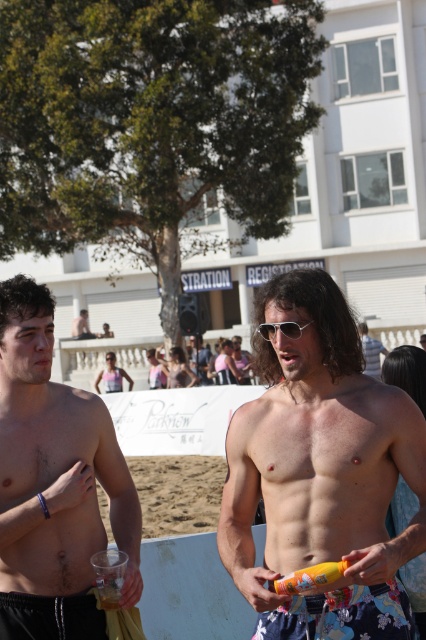
What is the relationship between the size of the black matte shorts at lower left and the shiny silver phone at right?

The black matte shorts at lower left has a smaller size compared to the shiny silver phone at right.

You are a photographer trying to capture a closeup shot of both the smooth tan skin at center and the yellow matte can at center. Given that your camera has a maximum focus range of 16 inches, will you be able to capture both objects in focus at the same time?

The smooth tan skin at center and the yellow matte can at center are 16.63 inches apart from each other, which exceeds the camera maximum focus range of 16 inches. Therefore, you cannot capture both objects in focus at the same time.

You are standing at the beach and want to take a photo of the smooth tan skin at center. If your camera has a maximum focus range of 10 feet, will you need to move closer to capture it clearly?

The smooth tan skin at center is 10.69 feet away from the viewer. Since the camera can only focus up to 10 feet, you need to move closer to ensure it is within the 10 feet range for clear capture.